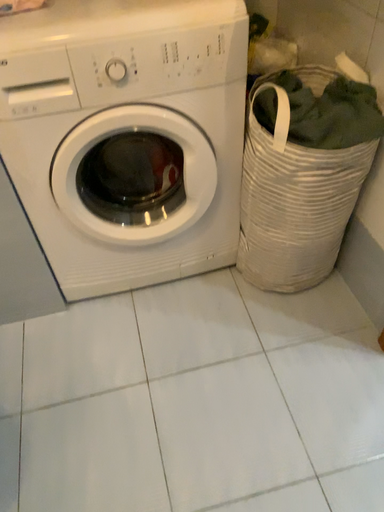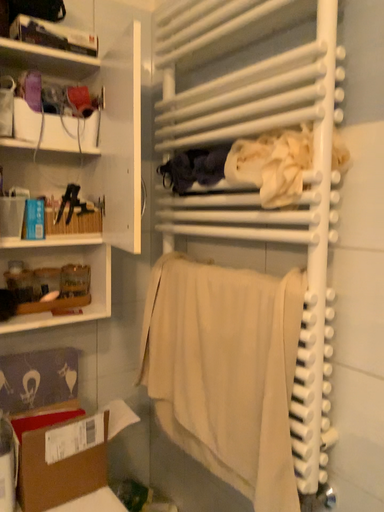
Question: How did the camera likely rotate when shooting the video?

Choices:
 (A) rotated left
 (B) rotated right

Answer: (B)